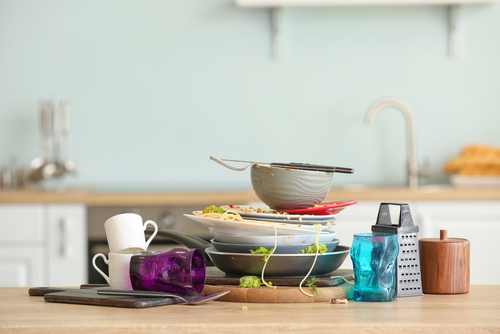
Find the location of `pasta bowls`. pasta bowls is located at coordinates (248, 239), (215, 223), (227, 246), (227, 257).